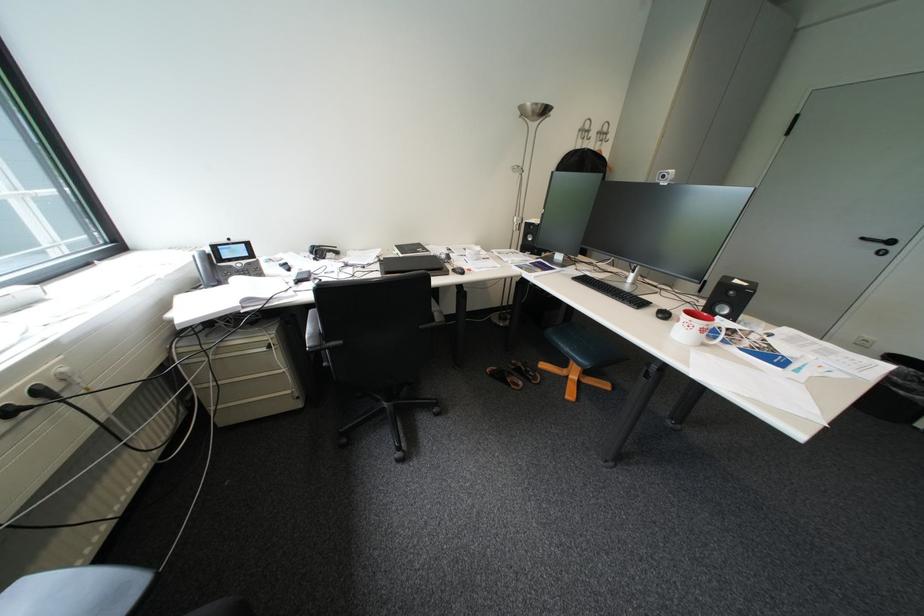
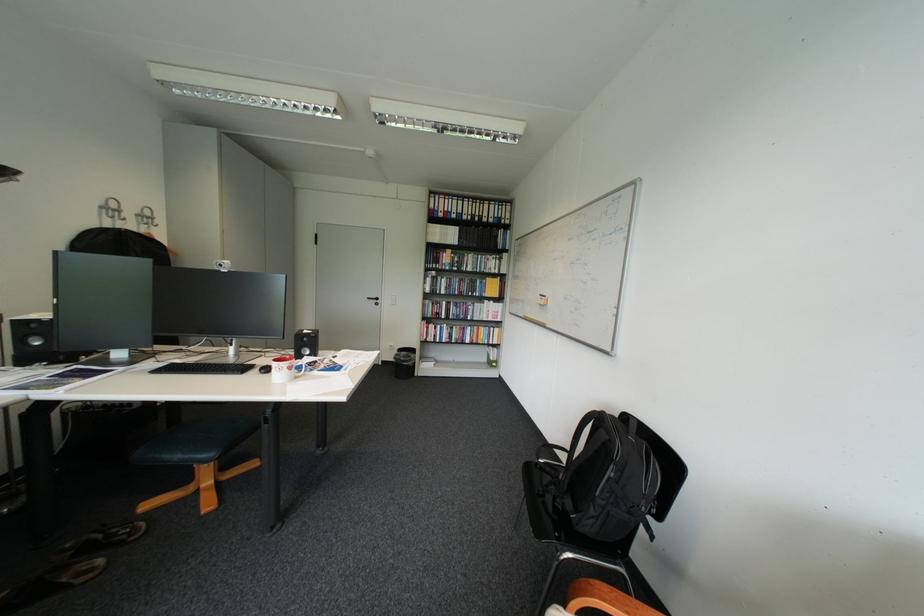
In the second image, find the point that corresponds to point 572,342 in the first image.

(176, 456)